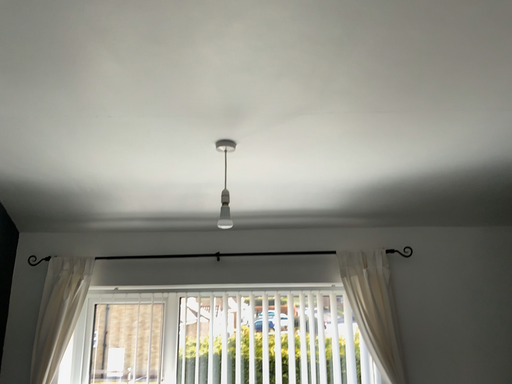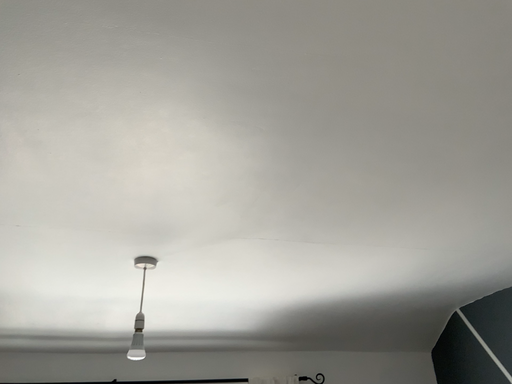
Question: Which way did the camera rotate in the video?

Choices:
 (A) rotated downward
 (B) rotated upward

Answer: (B)